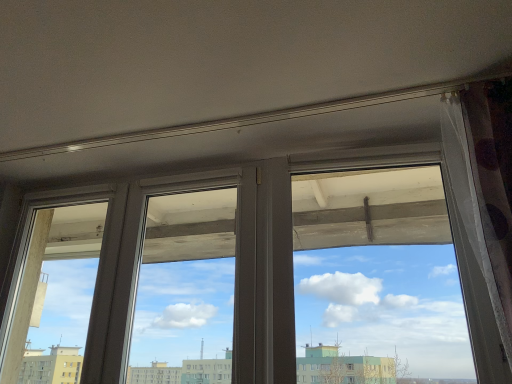
Question: Should I look upward or downward to see transparent plastic window screen at upper right?

Choices:
 (A) up
 (B) down

Answer: (B)